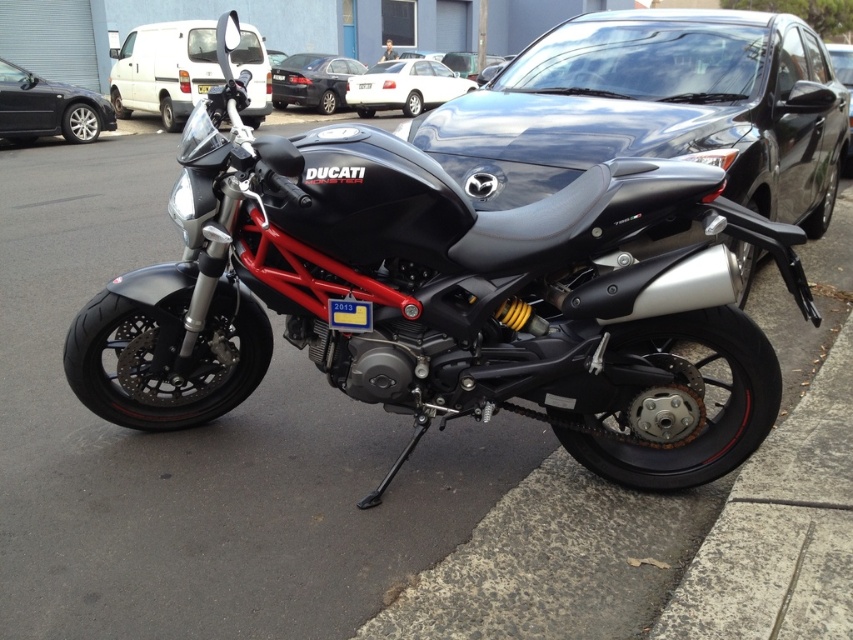
Does point (323, 228) come farther from viewer compared to point (671, 17)?

No, (323, 228) is closer to viewer.

Does point (634, 264) lie in front of point (614, 72)?

Yes.

Who is more forward, [467,360] or [500,120]?

Point [467,360]

Locate an element on the screen. This screenshot has height=640, width=853. matte black motorcycle at center is located at coordinates (445, 300).

How much distance is there between matte black motorcycle at center and white glossy sedan at center?

15.21 meters

Is matte black motorcycle at center closer to camera compared to white glossy sedan at center?

That is True.

The image size is (853, 640). Describe the element at coordinates (445, 300) in the screenshot. I see `matte black motorcycle at center` at that location.

Find the location of a particular element. The height and width of the screenshot is (640, 853). matte black motorcycle at center is located at coordinates (445, 300).

Who is positioned more to the right, matte black motorcycle at center or black metallic sedan at left?

Positioned to the right is matte black motorcycle at center.

Is point (229, 230) positioned behind point (26, 106)?

No, (229, 230) is in front of (26, 106).

Does point (608, 224) come behind point (44, 77)?

No.

The image size is (853, 640). I want to click on matte black motorcycle at center, so click(x=445, y=300).